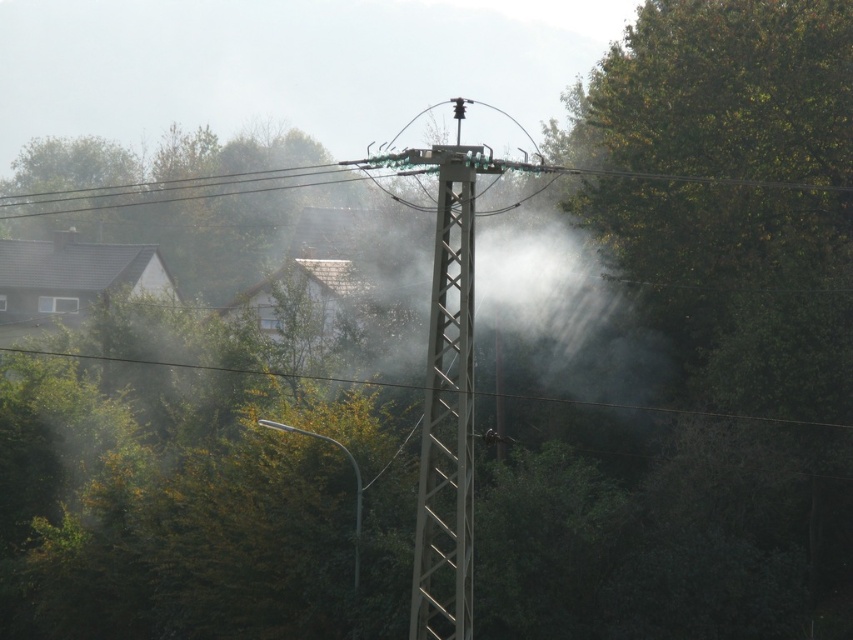
Question: Does metallic gray telegraph pole at center have a lesser width compared to green leafy tree at upper left?

Choices:
 (A) yes
 (B) no

Answer: (A)

Question: Where is metallic gray telegraph pole at center located in relation to green leafy tree at upper left in the image?

Choices:
 (A) above
 (B) below

Answer: (B)

Question: Which object appears farthest from the camera in this image?

Choices:
 (A) green leafy tree at upper left
 (B) metallic gray telegraph pole at center

Answer: (A)

Question: Can you confirm if metallic gray telegraph pole at center is thinner than green leafy tree at upper left?

Choices:
 (A) no
 (B) yes

Answer: (B)

Question: Which point is closer to the camera?

Choices:
 (A) tap(64, 204)
 (B) tap(433, 376)

Answer: (B)